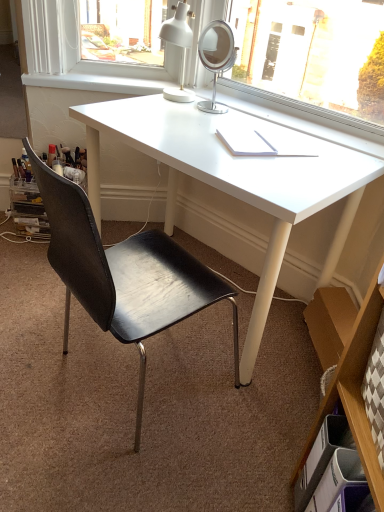
Find the location of a particular element. free location to the left of black leather chair at center is located at coordinates (28, 336).